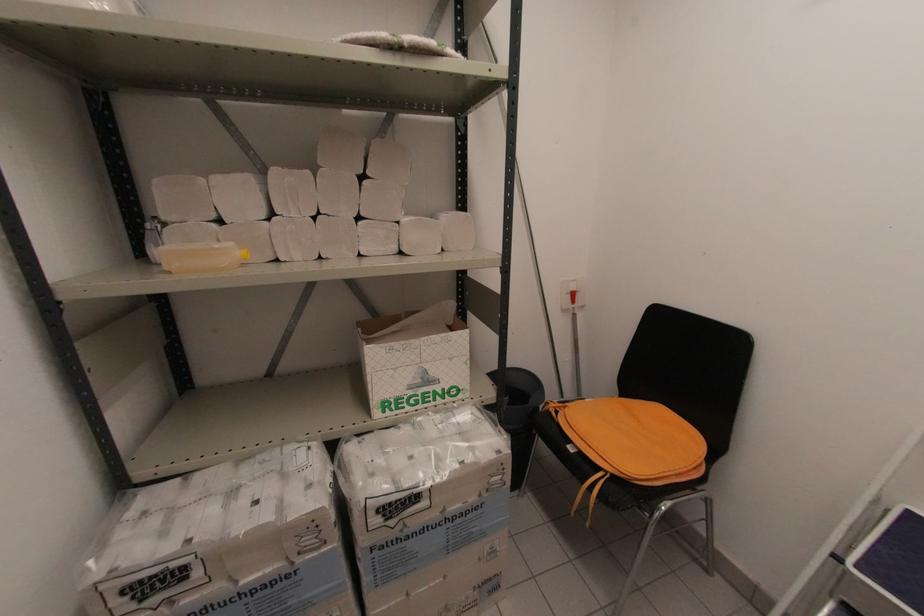
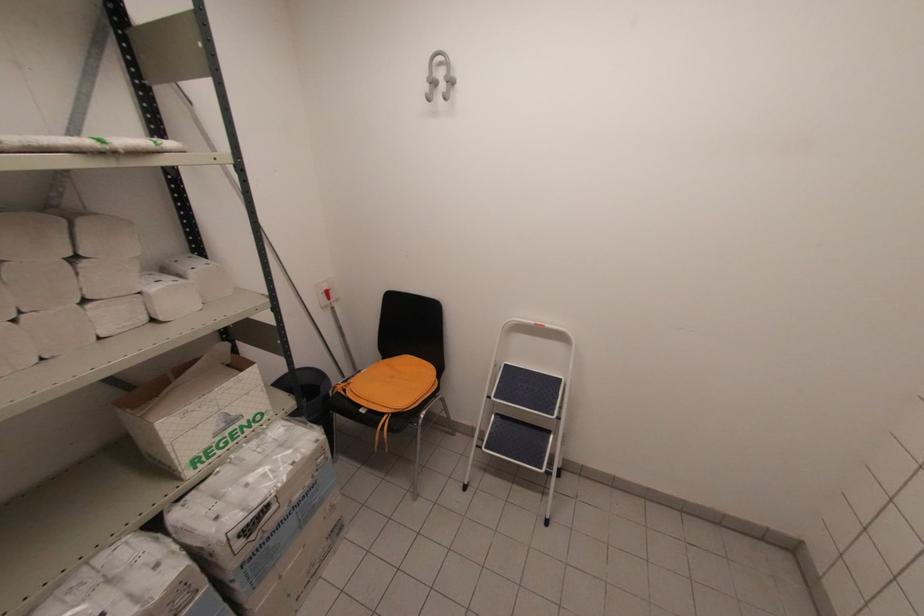
The point at (396,41) is marked in the first image. Where is the corresponding point in the second image?

(107, 148)